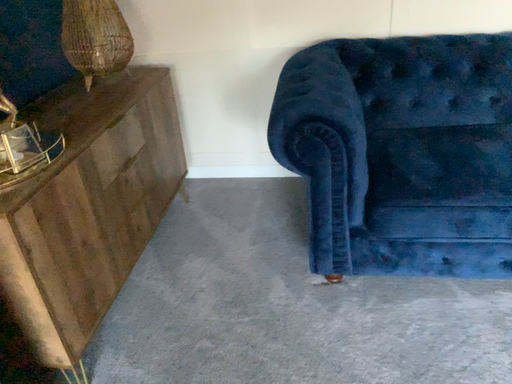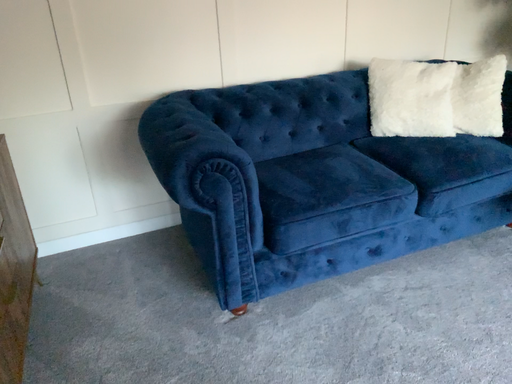
Question: How did the camera likely rotate when shooting the video?

Choices:
 (A) rotated downward
 (B) rotated upward

Answer: (B)